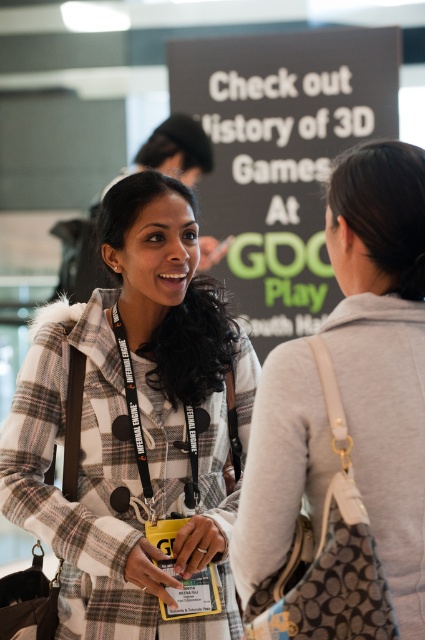
You are a photographer at the event and need to capture a photo of both the plaid wool coat at center and the black matte signboard at upper center in the same frame. The camera you are using has a maximum focal length that allows a distance of 12 feet between objects. Will you be able to include both in the shot?

The plaid wool coat at center and the black matte signboard at upper center are 12.17 feet apart from each other. Since the camera can only handle up to 12 feet, the distance is slightly too far, so they cannot both be included in the same frame.

You are at a gaming convention and want to approach the person wearing a plaid coat with a fur lined hood. You see two points marked as point 1 at coordinates (402,454) and point 2 at coordinates (285,220). Which point should you move towards to get closer to the person in the plaid coat?

You should move towards point 1 at coordinates (402,454) because it is in front of point 2 at coordinates (285,220), meaning it is closer to the person in the plaid coat with fur lined hood.

You are at the gaming convention and need to locate the plaid wool coat at center. Based on the scene description, where would you find it in relation to the two individuals described?

The plaid wool coat at center is located at point coordinates 0.666 on the x and 0.320 on the y axis, which places it centrally within the image frame between the two individuals described.